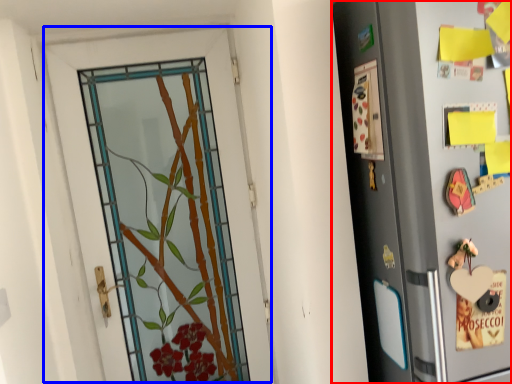
Question: Which point is further to the camera, refrigerator (highlighted by a red box) or door (highlighted by a blue box)?

Choices:
 (A) refrigerator
 (B) door

Answer: (B)